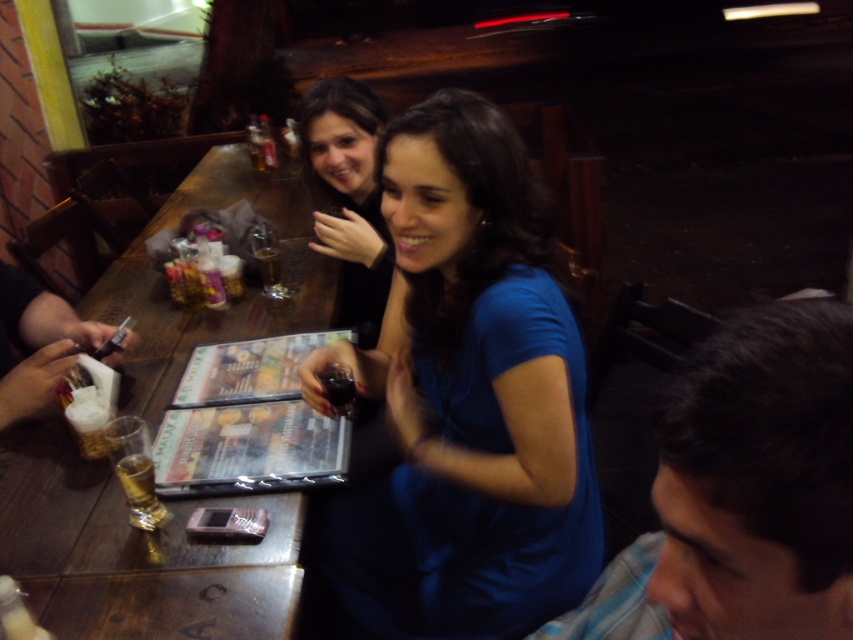
Question: Among these points, which one is farthest from the camera?

Choices:
 (A) (274, 237)
 (B) (814, 516)

Answer: (A)

Question: Observing the image, what is the correct spatial positioning of blue matte shirt at center in reference to wooden table at center?

Choices:
 (A) above
 (B) below

Answer: (B)

Question: Considering the real-world distances, which object is closest to the matte black dress at center?

Choices:
 (A) blue shirt at center
 (B) translucent glass at table center
 (C) wooden table at center

Answer: (B)

Question: Is blue matte shirt at center to the left of matte black dress at center from the viewer's perspective?

Choices:
 (A) yes
 (B) no

Answer: (B)

Question: Does blue shirt at center appear on the right side of wooden table at center?

Choices:
 (A) no
 (B) yes

Answer: (B)

Question: Which is nearer to the translucent glass wine at table left?

Choices:
 (A) translucent glass at table center
 (B) blue matte shirt at center

Answer: (B)